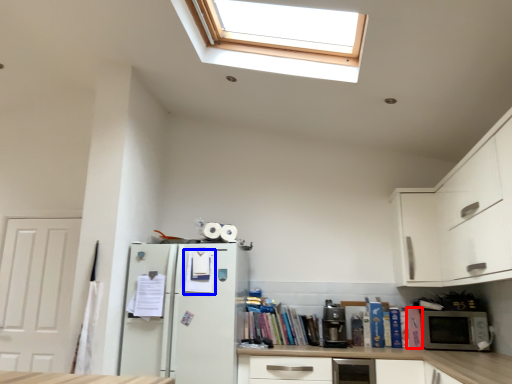
Question: Which point is further to the camera, book (highlighted by a red box) or book (highlighted by a blue box)?

Choices:
 (A) book
 (B) book

Answer: (A)